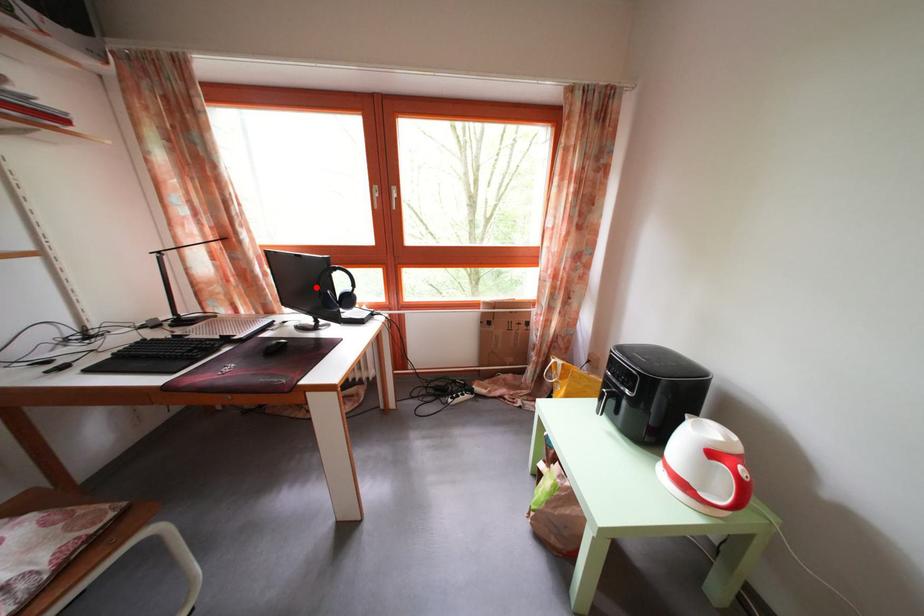
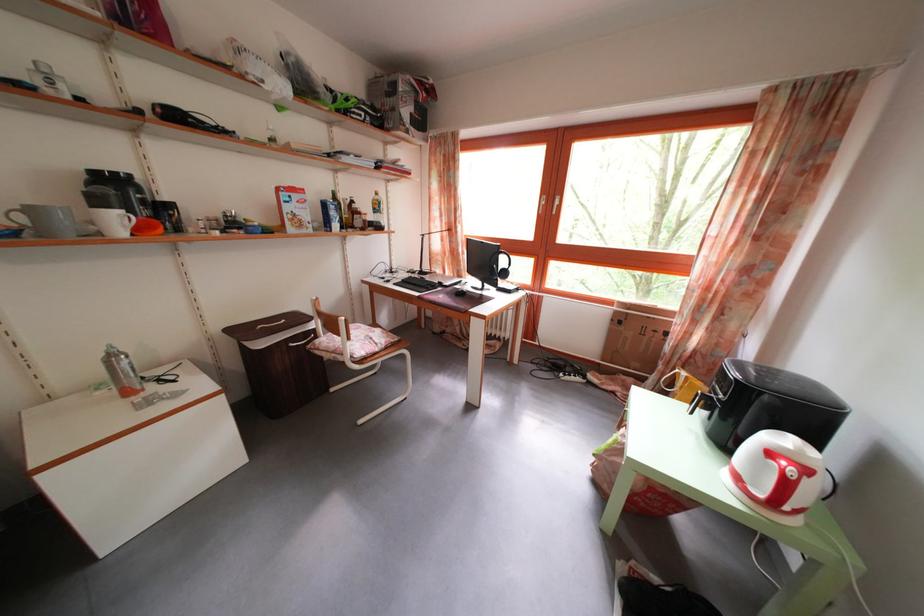
Question: A red point is marked in image1. In image2, is the corresponding 3D point closer to the camera or farther? Reply with the corresponding letter.

Choices:
 (A) The corresponding 3D point is closer.
 (B) The corresponding 3D point is farther.

Answer: (A)